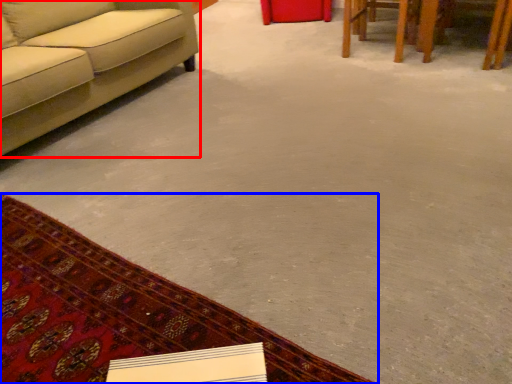
Question: Which object appears farthest to the camera in this image, studio couch (highlighted by a red box) or mat (highlighted by a blue box)?

Choices:
 (A) studio couch
 (B) mat

Answer: (A)